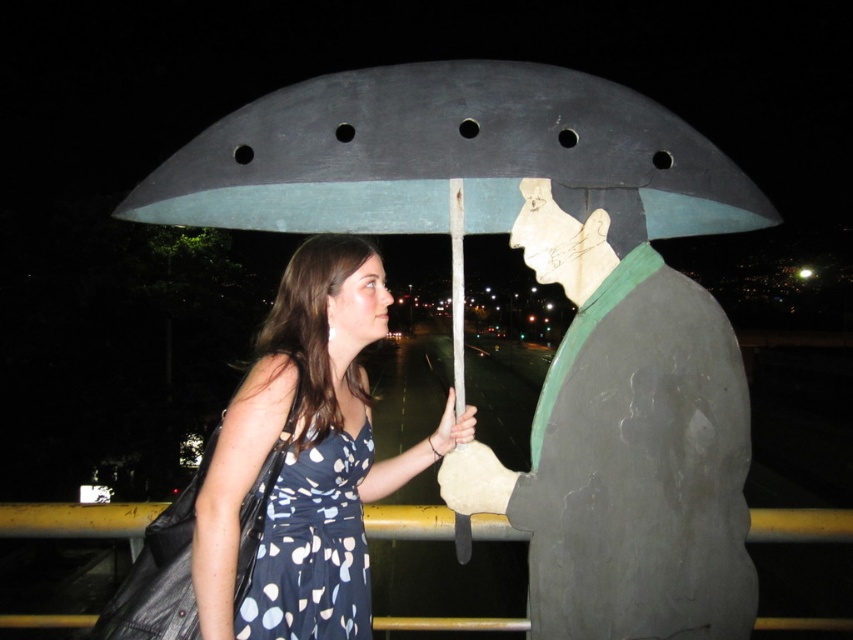
Which is behind, point (599, 563) or point (454, 444)?

The point (454, 444) is behind.

Is point (711, 353) positioned in front of point (326, 406)?

Yes.

Is point (532, 548) positioned before point (331, 273)?

That is True.

Identify the location of matte gray statue at center. The image size is (853, 640). (624, 448).

Is matte gray statue at center below blue dotted fabric dress at center?

No, matte gray statue at center is not below blue dotted fabric dress at center.

What do you see at coordinates (624, 448) in the screenshot? Image resolution: width=853 pixels, height=640 pixels. I see `matte gray statue at center` at bounding box center [624, 448].

What are the coordinates of `matte gray statue at center` in the screenshot? It's located at (624, 448).

Where is `matte gray statue at center`? matte gray statue at center is located at coordinates (624, 448).

Looking at this image, between metallic gray umbrella at center and polka dot dress at center, which one has less height?

Standing shorter between the two is metallic gray umbrella at center.

Is point (305, 168) in front of point (270, 419)?

Yes, it is.

Is point (285, 205) positioned before point (341, 259)?

No, it is behind (341, 259).

Locate an element on the screen. The image size is (853, 640). metallic gray umbrella at center is located at coordinates (445, 160).